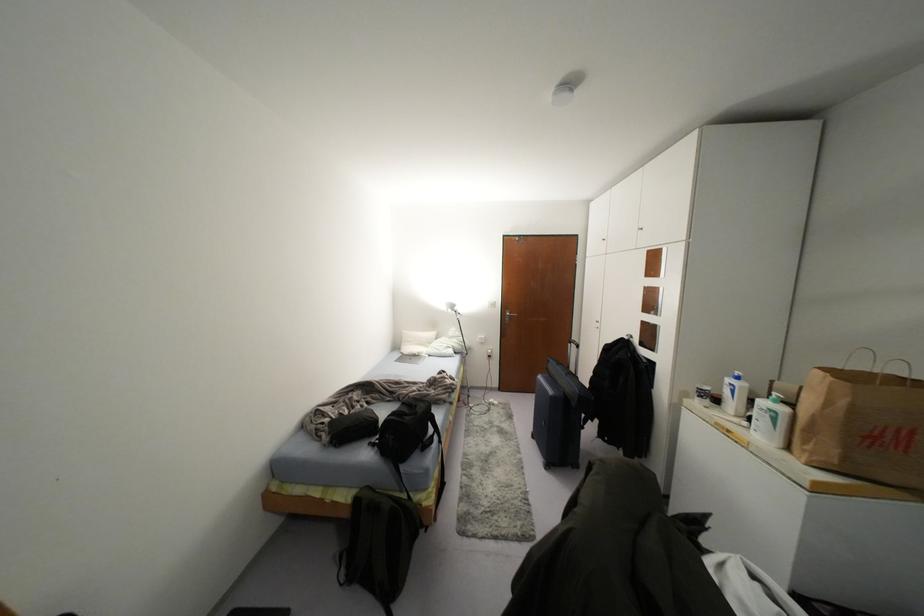
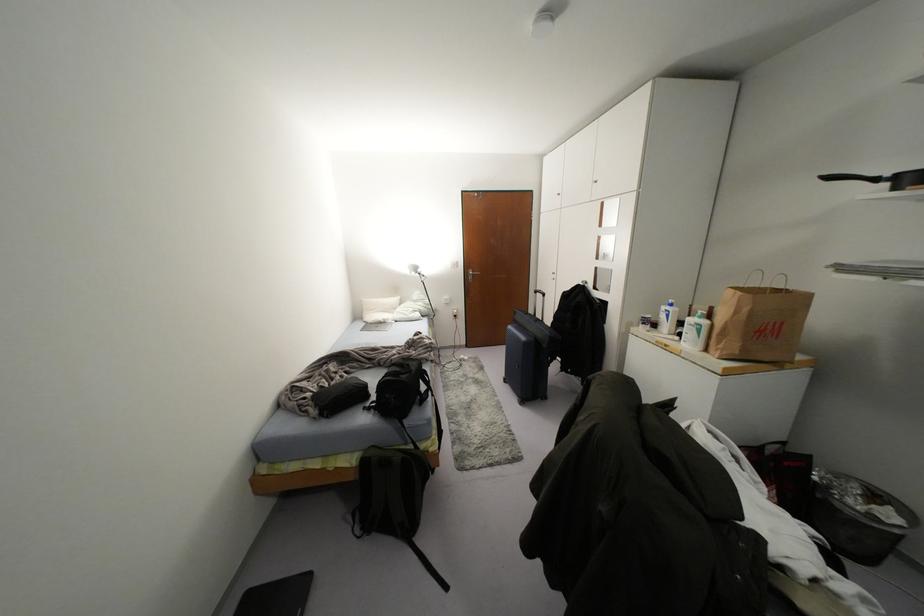
In the second image, find the point that corresponds to (455,308) in the first image.

(419, 270)